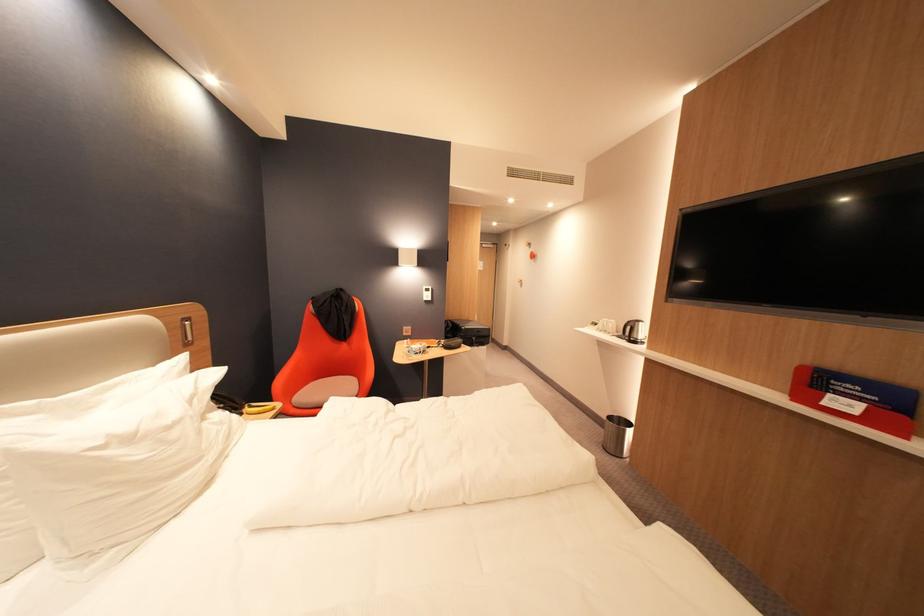
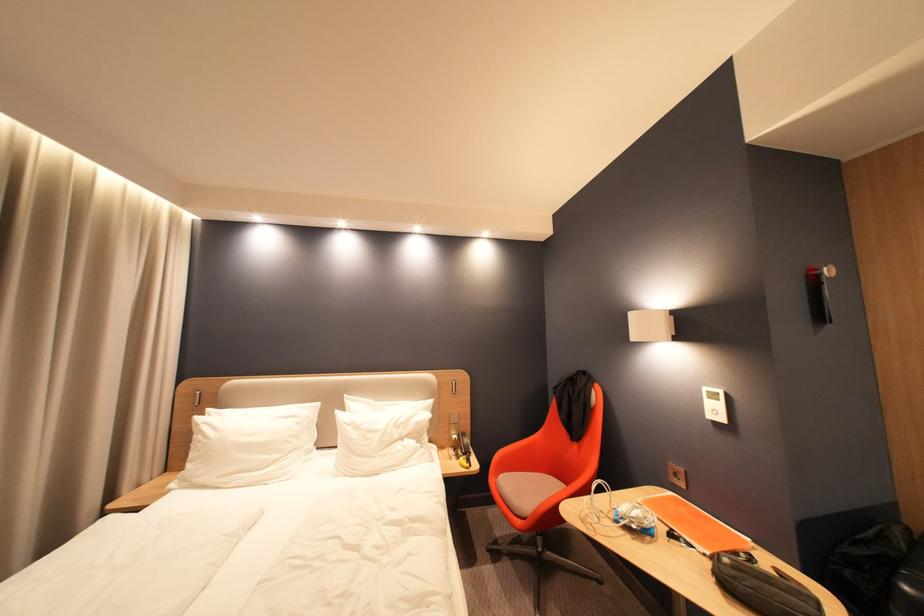
Where in the second image is the point corresponding to pixel 420 361 from the first image?

(592, 523)